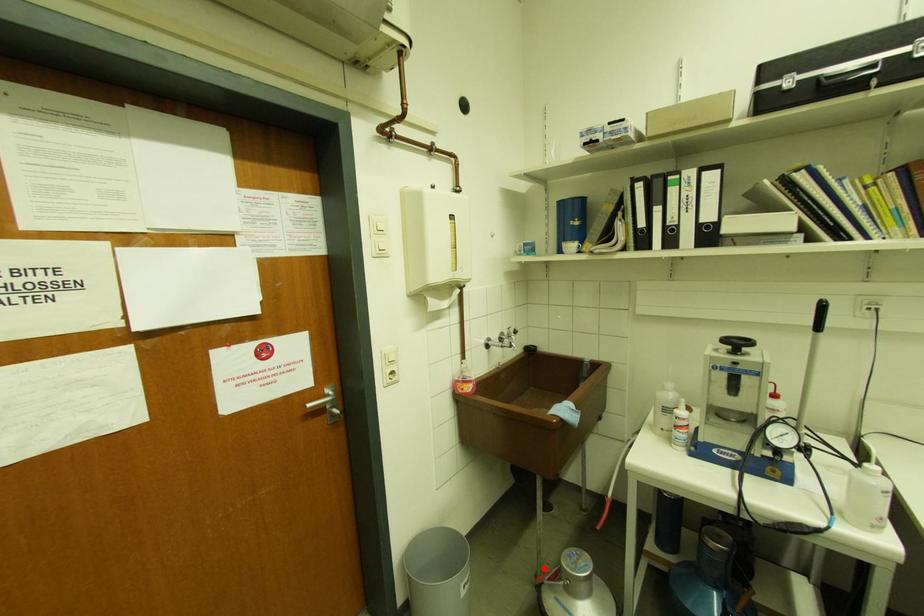
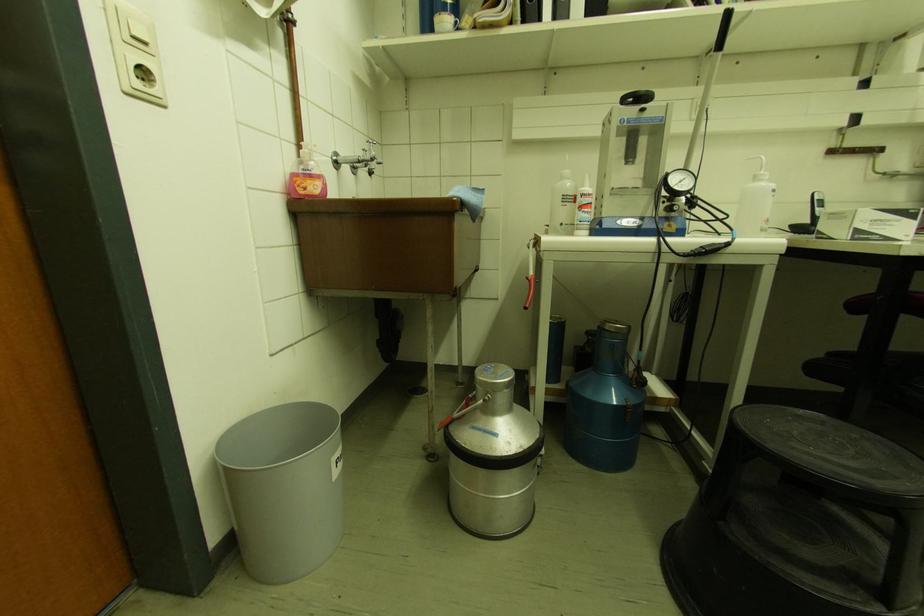
Find the pixel in the second image that matches the highlighted location in the first image.

(436, 429)